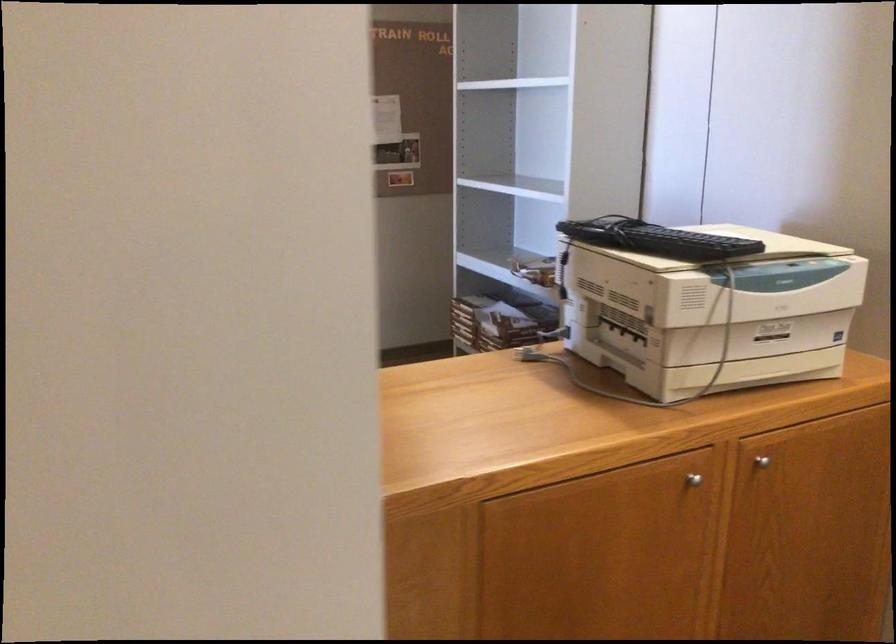
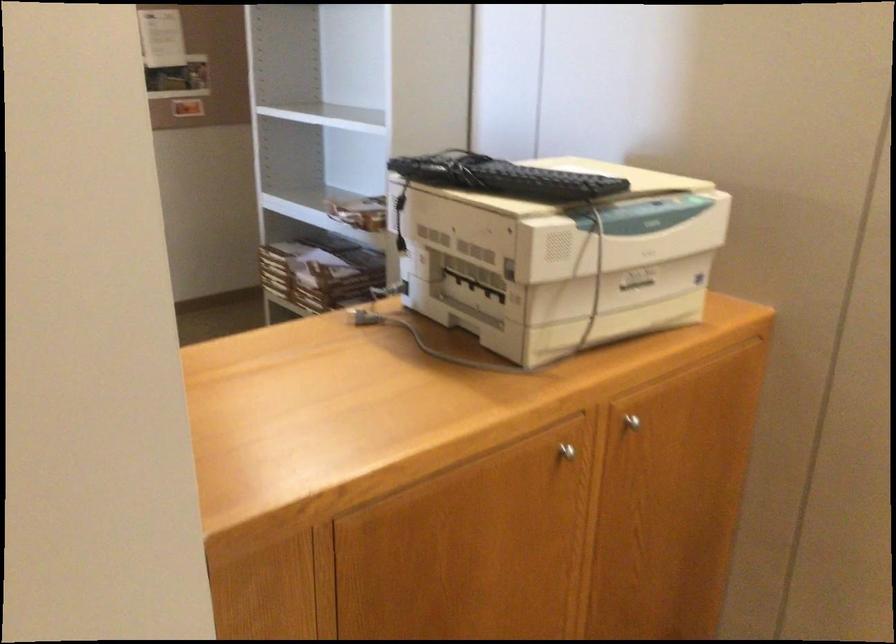
Question: What movement of the cameraman would produce the second image?

Choices:
 (A) Left
 (B) Right
 (C) Forward
 (D) Backward

Answer: (D)